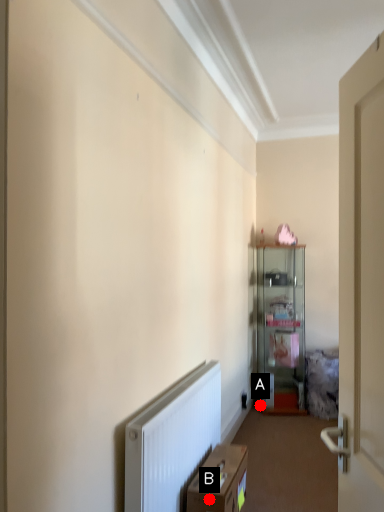
Question: Two points are circled on the image, labeled by A and B beside each circle. Among these points, which one is nearest to the camera?

Choices:
 (A) A is closer
 (B) B is closer

Answer: (B)